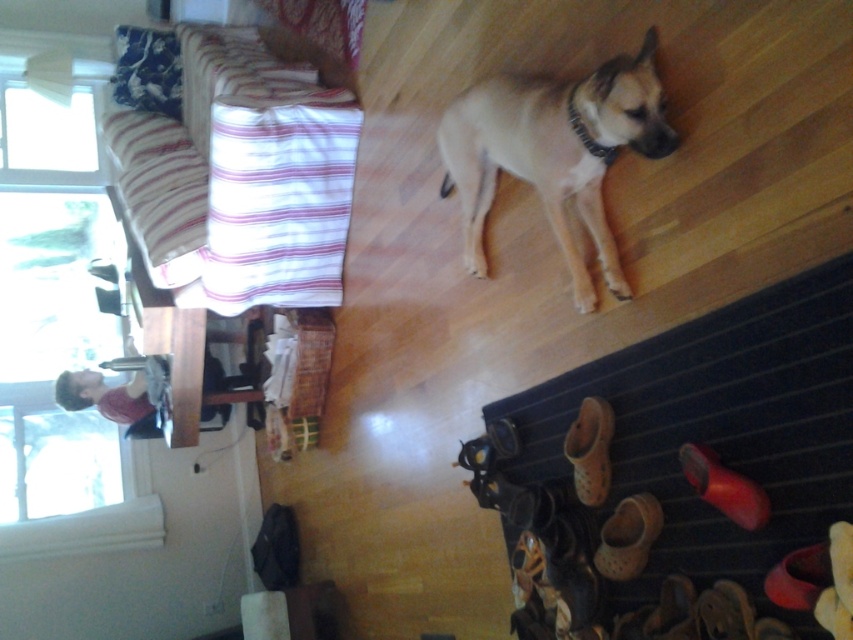
Question: Estimate the real-world distances between objects in this image. Which object is closer to the black leather collar at center?

Choices:
 (A) light brown fur at center
 (B) red rubber boot at lower right
 (C) brown mesh shoe at lower center

Answer: (A)

Question: Which of the following is the closest to the observer?

Choices:
 (A) tan croc at lower right
 (B) fluffy blue pillow at upper left
 (C) black leather collar at center
 (D) rubber/leather shoe at lower right

Answer: (D)

Question: Which object is the closest to the brown mesh shoe at lower center?

Choices:
 (A) tan croc at lower right
 (B) fluffy blue pillow at upper left
 (C) light brown fur at center
 (D) red rubber boot at lower right

Answer: (A)

Question: Is brown mesh shoe at lower center wider than black leather collar at center?

Choices:
 (A) no
 (B) yes

Answer: (B)

Question: Can you confirm if fluffy blue pillow at upper left is smaller than red rubber boot at lower right?

Choices:
 (A) no
 (B) yes

Answer: (A)

Question: Does light brown fur at center have a larger size compared to tan croc at lower right?

Choices:
 (A) no
 (B) yes

Answer: (B)